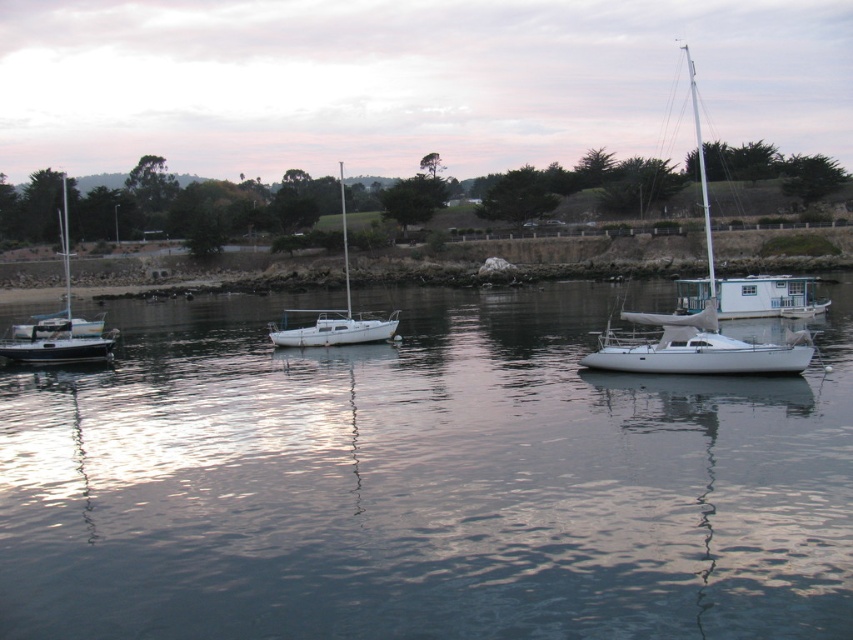
Question: Which point is closer to the camera?

Choices:
 (A) (706, 372)
 (B) (28, 324)
 (C) (322, 323)
 (D) (399, 572)

Answer: (D)

Question: Which of the following is the farthest from the observer?

Choices:
 (A) (68, 250)
 (B) (503, 353)
 (C) (349, 332)

Answer: (A)

Question: Is white glossy sailboat at right further to camera compared to white matte sailboat at left?

Choices:
 (A) yes
 (B) no

Answer: (B)

Question: Is the position of transparent water at center more distant than that of white glossy sailboat at right?

Choices:
 (A) yes
 (B) no

Answer: (B)

Question: Is white glossy sailboat at right further to camera compared to white matte sailboat at left?

Choices:
 (A) no
 (B) yes

Answer: (A)

Question: Which point appears closest to the camera in this image?

Choices:
 (A) (13, 349)
 (B) (138, 520)

Answer: (B)